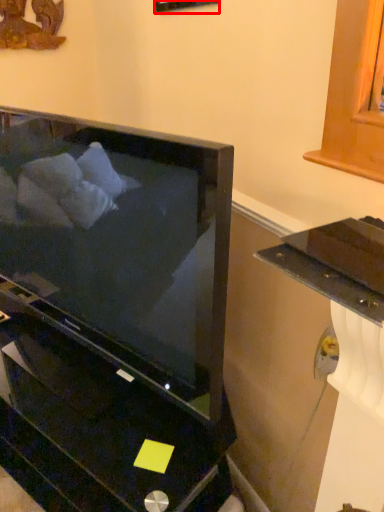
Question: Observing the image, what is the correct spatial positioning of picture frame (annotated by the red box) in reference to furniture?

Choices:
 (A) right
 (B) left

Answer: (A)